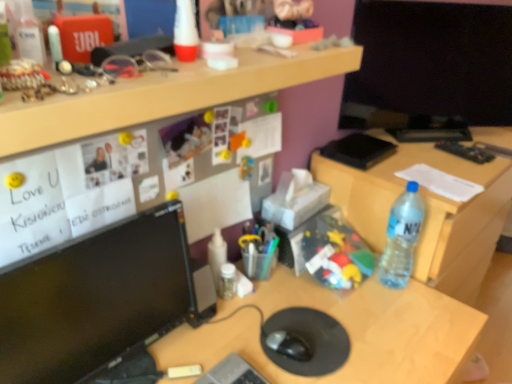
In order to click on free location in front of translucent plastic bottle at right, which appears as the 1th bottle when viewed from the right in this screenshot , I will do `click(404, 317)`.